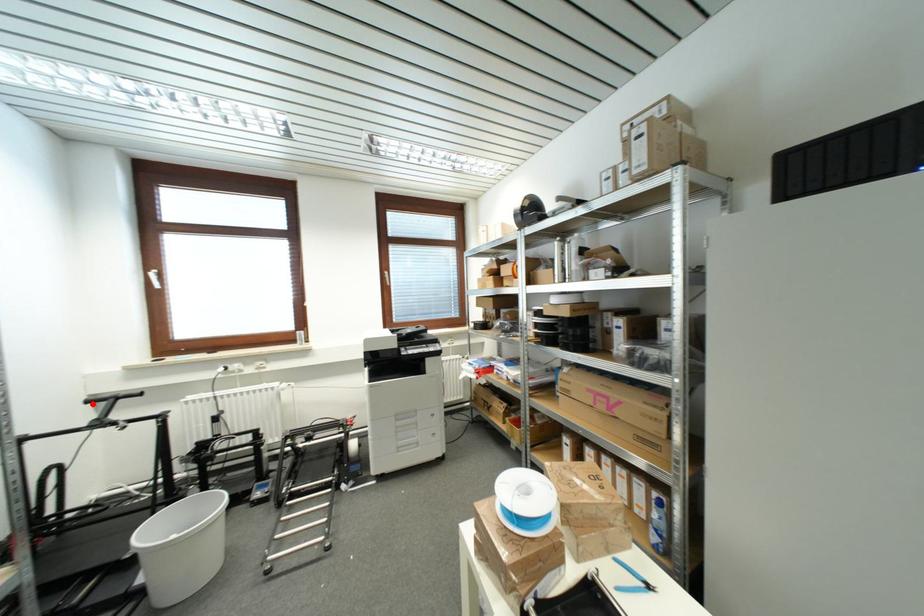
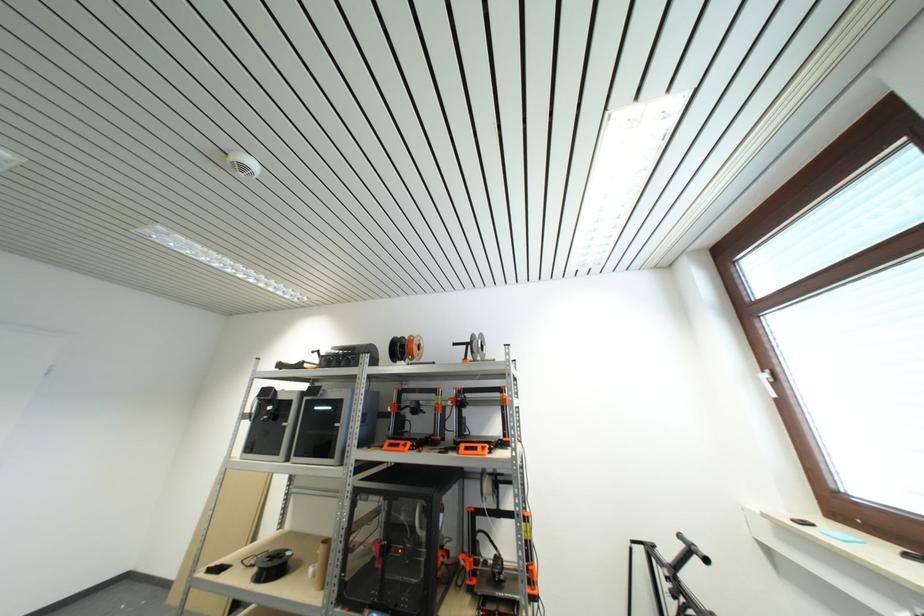
Question: A red point is marked in image1. In image2, is the corresponding 3D point closer to the camera or farther? Reply with the corresponding letter.

Choices:
 (A) The corresponding 3D point is closer.
 (B) The corresponding 3D point is farther.

Answer: (A)